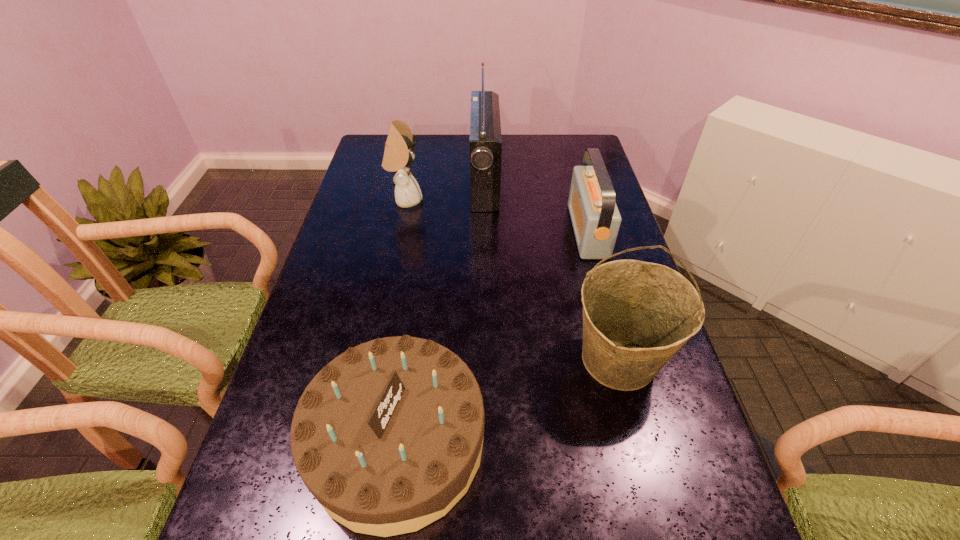
Identify the location of vacant area at the left edge of the desktop. The image size is (960, 540). (300, 398).

Locate an element on the screen. The height and width of the screenshot is (540, 960). vacant space at the right edge of the desktop is located at coordinates (691, 448).

What are the coordinates of `vacant space in between the left radio receiver and the doll` in the screenshot? It's located at (x=444, y=191).

The image size is (960, 540). Identify the location of empty location between the birthday cake and the shorter radio receiver. (492, 336).

You are a GUI agent. You are given a task and a screenshot of the screen. Output one action in this format:
    pyautogui.click(x=<x>, y=<y>)
    Task: Click on the free space between the doll and the birthday cake
    Image resolution: width=960 pixels, height=540 pixels.
    Given the screenshot: What is the action you would take?
    pyautogui.click(x=401, y=321)

You are a GUI agent. You are given a task and a screenshot of the screen. Output one action in this format:
    pyautogui.click(x=<x>, y=<y>)
    Task: Click on the empty space between the birthday cake and the shorter radio receiver
    
    Given the screenshot: What is the action you would take?
    pyautogui.click(x=492, y=336)

Where is `blank region between the left radio receiver and the wine bucket`? blank region between the left radio receiver and the wine bucket is located at coordinates (552, 271).

Image resolution: width=960 pixels, height=540 pixels. In order to click on object that ranks as the fourth closest to the left radio receiver in this screenshot , I will do `click(388, 436)`.

Find the location of a particular element. Image resolution: width=960 pixels, height=540 pixels. the fourth closest object to the left radio receiver is located at coordinates (388, 436).